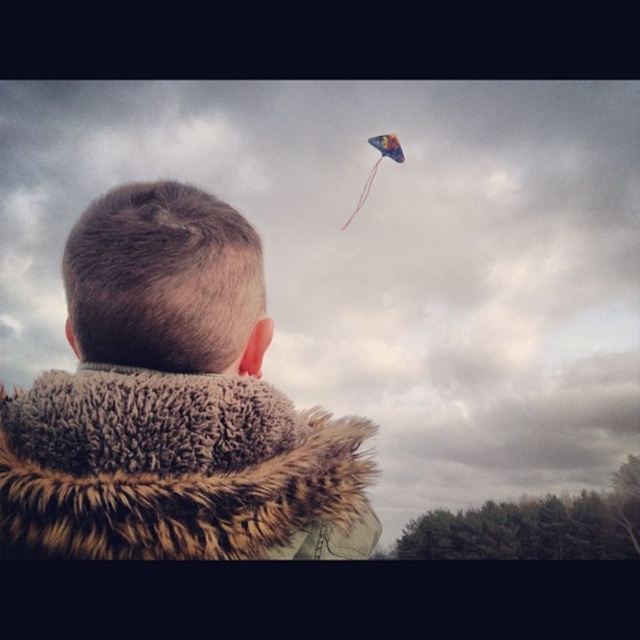
Question: Which of the following is the closest to the observer?

Choices:
 (A) fuzzy brown coat at upper center
 (B) multicolored paper kite at upper center

Answer: (A)

Question: Does fuzzy brown coat at upper center appear under multicolored paper kite at upper center?

Choices:
 (A) yes
 (B) no

Answer: (A)

Question: Which point is farther to the camera?

Choices:
 (A) (83, 212)
 (B) (365, 182)

Answer: (B)

Question: Is fuzzy brown coat at upper center wider than multicolored paper kite at upper center?

Choices:
 (A) yes
 (B) no

Answer: (B)

Question: From the image, what is the correct spatial relationship of fuzzy brown coat at upper center in relation to multicolored paper kite at upper center?

Choices:
 (A) left
 (B) right

Answer: (A)

Question: Which point appears farthest from the camera in this image?

Choices:
 (A) (392, 160)
 (B) (284, 480)

Answer: (A)